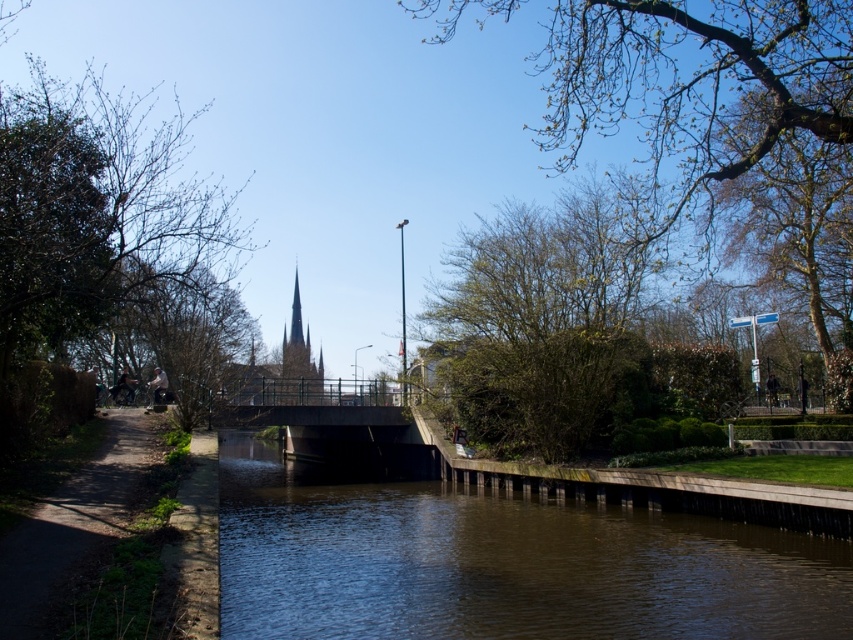
Question: Estimate the real-world distances between objects in this image. Which object is farther from the green leafy tree at upper right?

Choices:
 (A) dirt path at left
 (B) brown concrete river at center

Answer: (A)

Question: Does bare branches at left have a greater width compared to dark brown stone tower at center?

Choices:
 (A) no
 (B) yes

Answer: (B)

Question: Which of the following is the farthest from the observer?

Choices:
 (A) smooth gray spire at center
 (B) dark brown stone tower at center
 (C) bare branches at left

Answer: (A)

Question: Considering the relative positions of brown concrete river at center and bare branches at left in the image provided, where is brown concrete river at center located with respect to bare branches at left?

Choices:
 (A) above
 (B) below

Answer: (B)

Question: Which object is closer to the camera taking this photo?

Choices:
 (A) brown concrete river at center
 (B) green leafy tree at upper right
 (C) bare branches at left
 (D) dark brown stone tower at center

Answer: (A)

Question: Considering the relative positions of bare branches at left and green leafy tree at upper right in the image provided, where is bare branches at left located with respect to green leafy tree at upper right?

Choices:
 (A) above
 (B) below

Answer: (B)